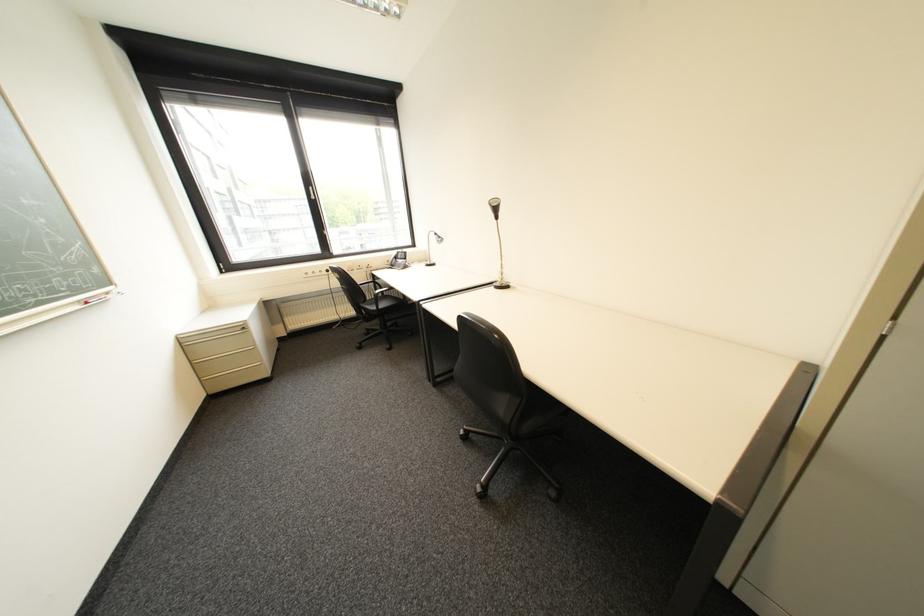
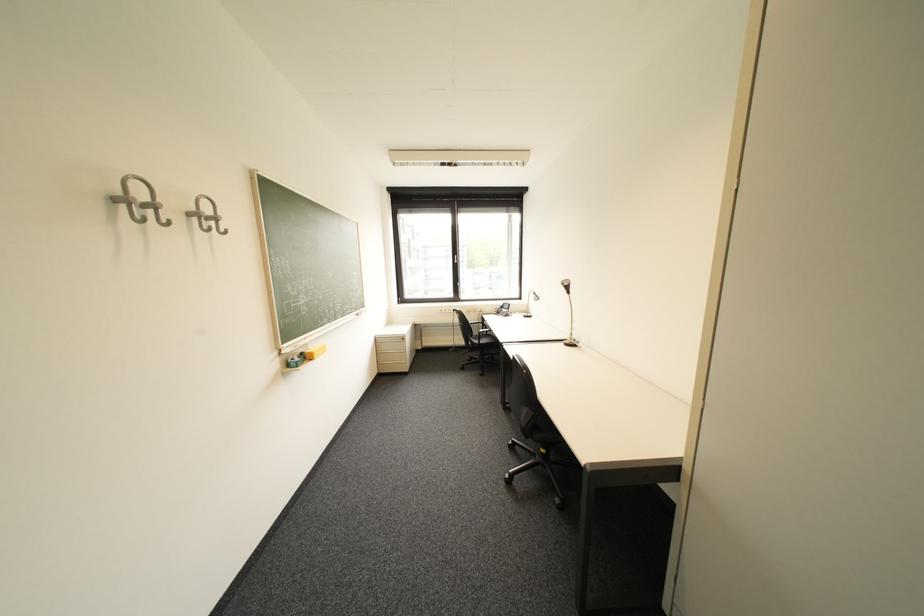
Where in the second image is the point corresponding to the point at 198,345 from the first image?

(388, 342)